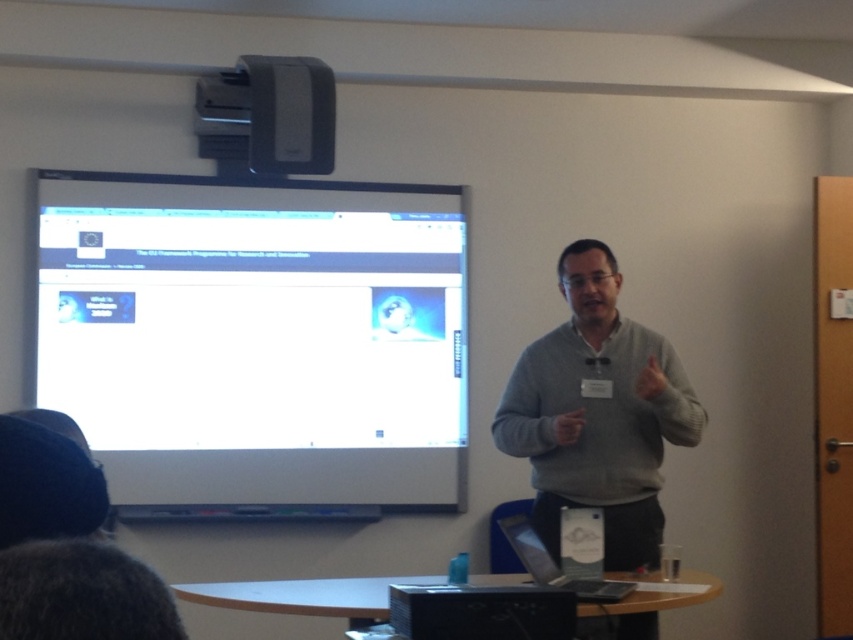
Question: Can you confirm if white glossy projection screen at upper left is bigger than gray sweater at center?

Choices:
 (A) no
 (B) yes

Answer: (B)

Question: Which is farther from the white glossy projection screen at upper left?

Choices:
 (A) gray sweater at center
 (B) matte gray projector at upper center

Answer: (A)

Question: Which object appears farthest from the camera in this image?

Choices:
 (A) matte gray projector at upper center
 (B) white glossy projection screen at upper left

Answer: (B)

Question: Does white glossy projection screen at upper left have a larger size compared to gray sweater at center?

Choices:
 (A) no
 (B) yes

Answer: (B)

Question: Based on their relative distances, which object is farther from the white glossy projection screen at upper left?

Choices:
 (A) matte gray projector at upper center
 (B) gray sweater at center

Answer: (B)

Question: Where is white glossy projection screen at upper left located in relation to gray sweater at center in the image?

Choices:
 (A) below
 (B) above

Answer: (B)